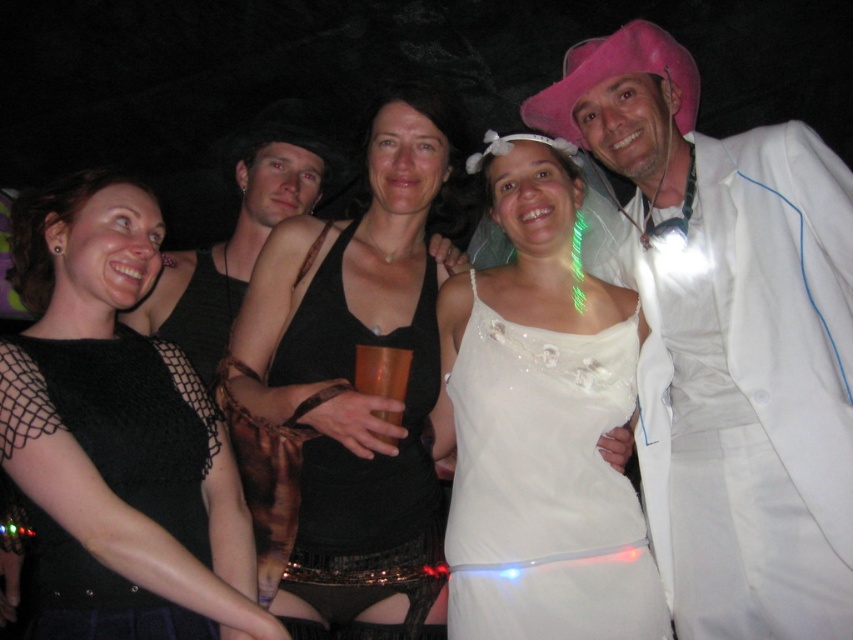
Question: Which point is farther from the camera taking this photo?

Choices:
 (A) click(399, 396)
 (B) click(65, 516)
 (C) click(589, 502)

Answer: (C)

Question: Can you confirm if white satin suit at upper right is positioned below black sequined dress at center?

Choices:
 (A) no
 (B) yes

Answer: (A)

Question: Can you confirm if white satin suit at upper right is wider than gold metallic cup at center?

Choices:
 (A) yes
 (B) no

Answer: (A)

Question: Which of the following is the farthest from the observer?

Choices:
 (A) (636, 148)
 (B) (111, 344)

Answer: (A)

Question: Which of the following is the closest to the observer?

Choices:
 (A) white satin dress at center
 (B) black sequined dress at center
 (C) black leather hat at upper center
 (D) gold metallic cup at center

Answer: (B)

Question: Observing the image, what is the correct spatial positioning of white satin dress at center in reference to black leather hat at upper center?

Choices:
 (A) left
 (B) right

Answer: (B)